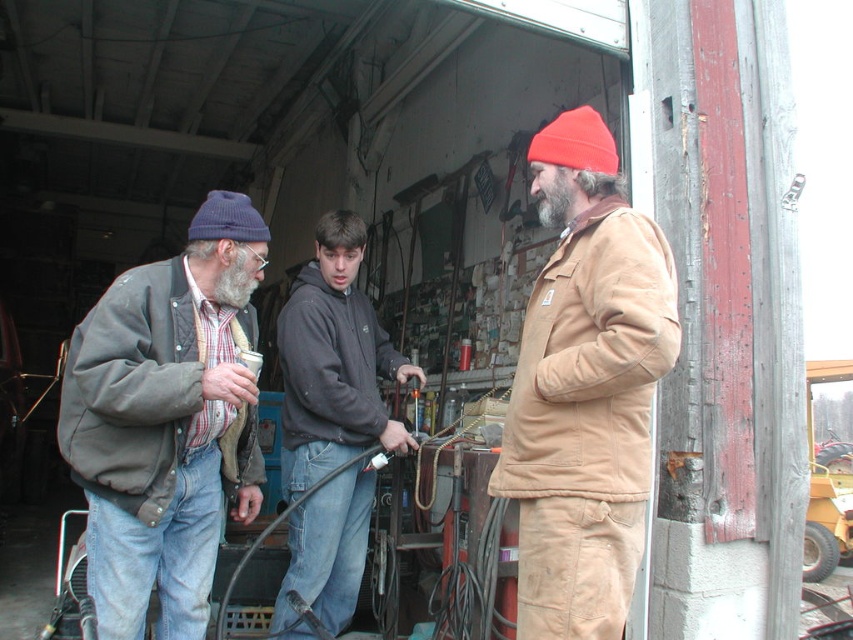
Question: Which point is farther to the camera?

Choices:
 (A) (323, 296)
 (B) (572, 160)
 (C) (242, 234)

Answer: (A)

Question: Which object is the closest to the gray/bearded man at center?

Choices:
 (A) matte gray jacket at left
 (B) knitted woolen beanie at left
 (C) dark gray fleece jacket at center

Answer: (A)

Question: Which object appears farthest from the camera in this image?

Choices:
 (A) dark gray hoodie at center
 (B) gray/bearded man at center
 (C) dark gray fleece jacket at center
 (D) knitted woolen beanie at left

Answer: (C)

Question: Is matte gray jacket at left above knitted woolen beanie at left?

Choices:
 (A) yes
 (B) no

Answer: (B)

Question: Can you confirm if matte gray jacket at left is thinner than orange knit beanie at center?

Choices:
 (A) yes
 (B) no

Answer: (B)

Question: Can you confirm if tan suede jacket at right is positioned below gray/bearded man at center?

Choices:
 (A) yes
 (B) no

Answer: (A)